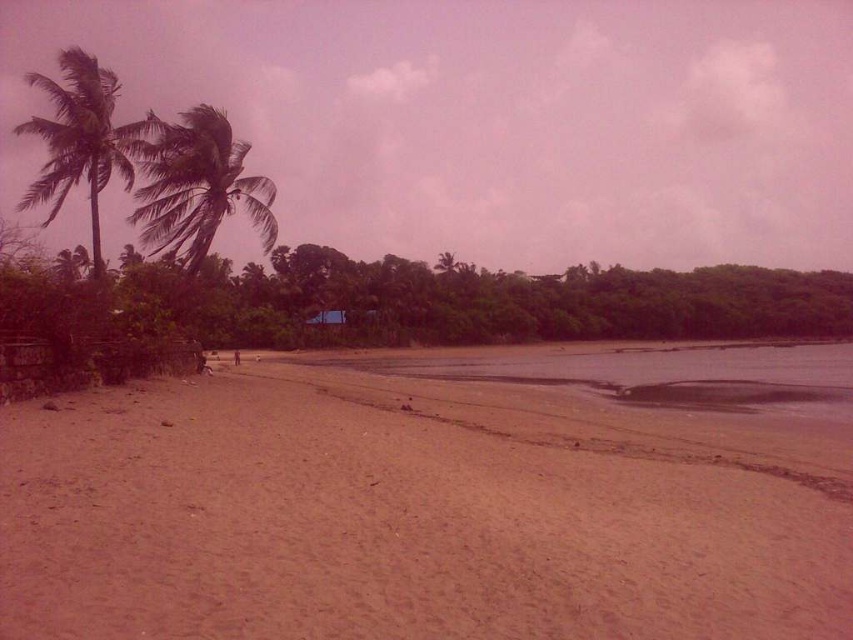
You are standing at the center of the image and want to walk to the sandy beach at lower left. Which direction should you head towards?

You should head towards the lower left direction to reach the sandy beach at lower left.

You are standing on the sandy beach at lower left and want to walk towards the green leafy palm tree at upper left. Which direction should you head to reach the palm tree?

Since the sandy beach at lower left is narrower than the green leafy palm tree at upper left, you should head towards the upper left direction to reach the palm tree.

You are standing on the beach and see two points marked on the sand. The first point is at coordinate point(154,160) and the second is at point(100,113). Which point is closer to you?

Point(154,160) is closer to you because it is further to the viewer than point(100,113).